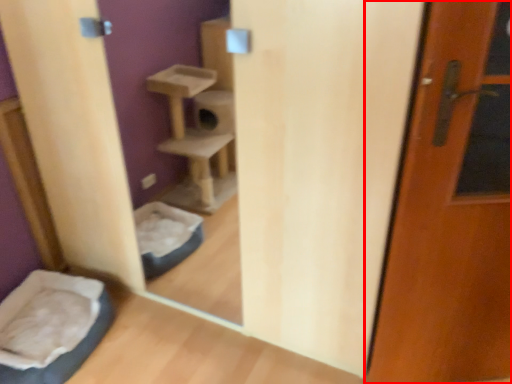
Question: Considering the relative positions of door (annotated by the red box) and wide in the image provided, where is door (annotated by the red box) located with respect to the staircase?

Choices:
 (A) left
 (B) right

Answer: (B)